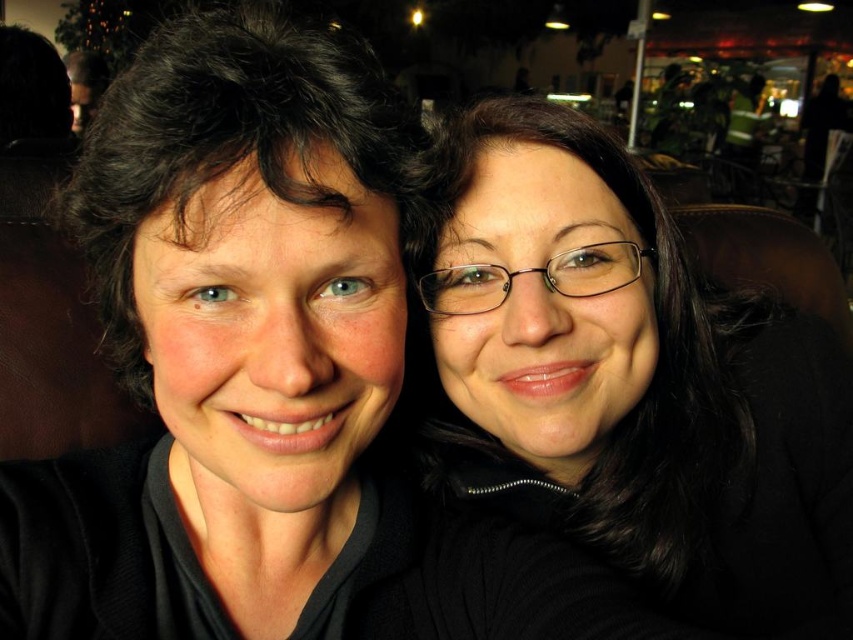
You are taking a photo of two people sitting at a table in a cafe. You want to focus on the person closer to the camera. Which coordinate point should you focus on, point (357, 205) or point (482, 449)?

Point (357, 205) is closer to the camera than point (482, 449), so you should focus on point (357, 205) to capture the person closer to the camera.

You are a photographer trying to adjust the lighting for a portrait. You notice the matte black hair at left and the black matte glasses at upper right. Which object should you focus the light on to ensure it stands out more, based on their vertical positions?

The black matte glasses at upper right should be focused on because they are taller than the matte black hair at left, allowing the light to highlight their position effectively.

You are a photographer taking a portrait of the two people in the image. You want to focus on the matte black hair at left. Where should you aim your camera to capture this feature precisely?

To capture the matte black hair at left precisely, aim your camera at point coordinates (227, 342).